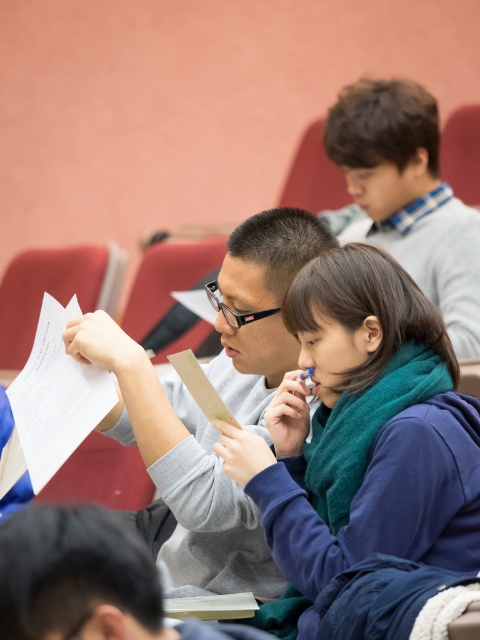
Question: Can you confirm if blue fleece jacket at center is thinner than light brown hair at upper right?

Choices:
 (A) yes
 (B) no

Answer: (B)

Question: Which object is positioned closest to the light brown hair at upper right?

Choices:
 (A) gray matte sweater at center
 (B) blue fleece jacket at center
 (C) white paper at lower left

Answer: (A)

Question: Which point is farther to the camera?

Choices:
 (A) (130, 381)
 (B) (340, 483)
 (C) (75, 371)

Answer: (C)

Question: Does gray matte sweater at center have a greater width compared to white paper at lower left?

Choices:
 (A) no
 (B) yes

Answer: (B)

Question: Does gray matte sweater at center have a larger size compared to white paper at lower left?

Choices:
 (A) yes
 (B) no

Answer: (A)

Question: Which object appears farthest from the camera in this image?

Choices:
 (A) gray matte sweater at center
 (B) white paper at lower left
 (C) light brown hair at upper right
 (D) blue fleece jacket at center

Answer: (C)